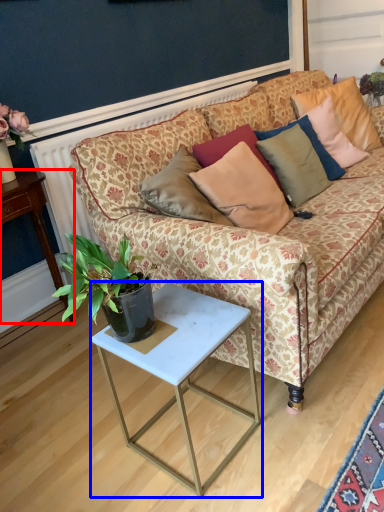
Question: Which of the following is the closest to the observer, desk (highlighted by a red box) or table (highlighted by a blue box)?

Choices:
 (A) desk
 (B) table

Answer: (B)